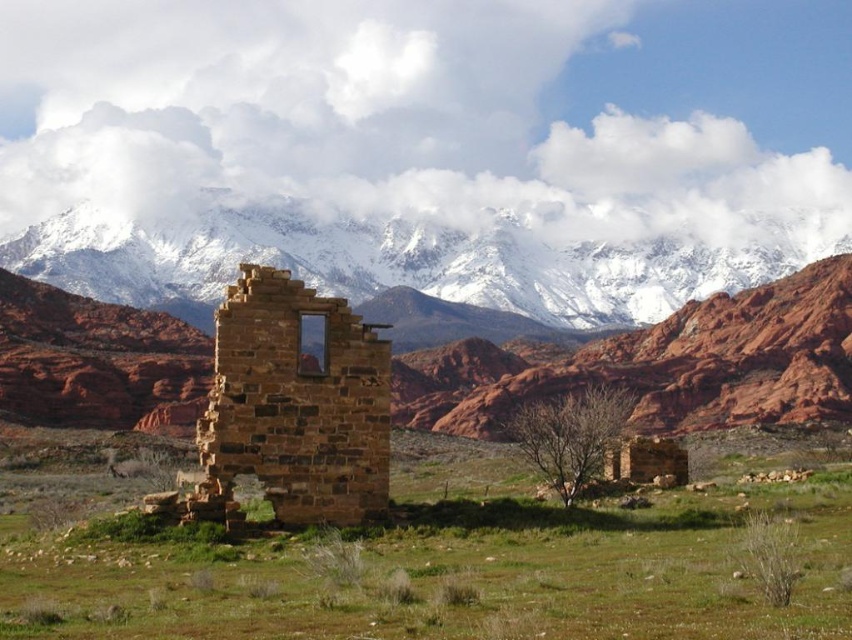
From the picture: You are an archaeologist examining the image. You notice the brown stone ruins at center and the snowy granite mountain range at upper center. Which of these two landmarks is closer to the camera based on their positions in the image?

The brown stone ruins at center is behind the snowy granite mountain range at upper center, so the snowy granite mountain range at upper center is closer to the camera.

You are an architect evaluating the site for a new observation deck. The deck must be positioned so that visitors can see both the brown stone ruins at center and the snowy granite mountain range at upper center. Based on their relative heights, which structure will appear larger in the viewfinder of a camera when both are framed together?

The snowy granite mountain range at upper center appears larger in the viewfinder because it has a greater height compared to the brown stone ruins at center.

You are a photographer standing in front of the dilapidated stone structure. You want to take a photo that includes both point (249, 204) and point (232, 332). Which point is closer to the camera?

Point (232, 332) is closer to the camera because the description states that point (249, 204) is further away than point (232, 332).